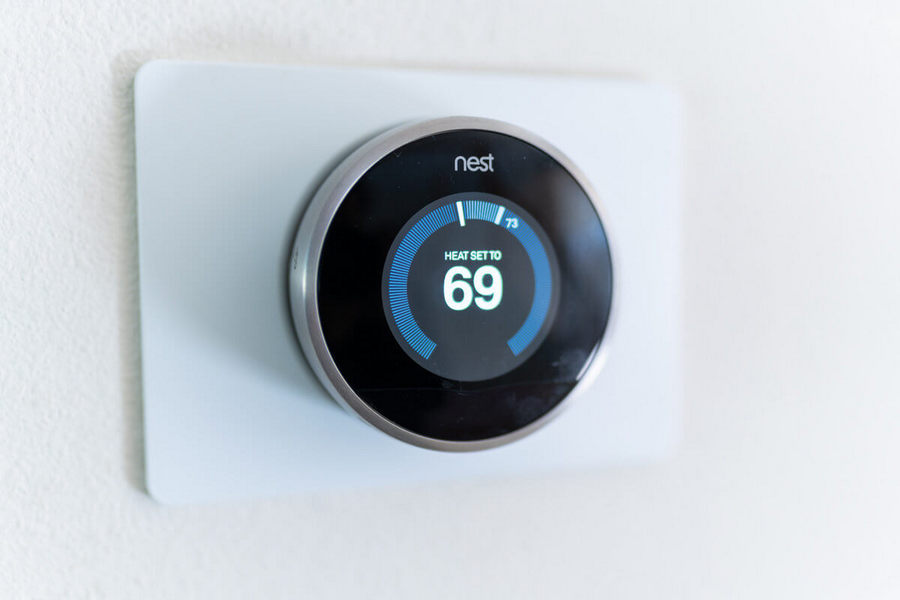
Identify the location of thermostat setting. The image size is (900, 600). (480, 282).